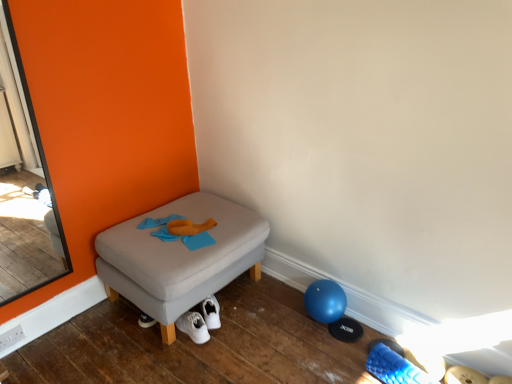
In order to click on vacant space that's between matte gray ottoman at center and white fabric shoe at lower center in this screenshot , I will do `click(279, 344)`.